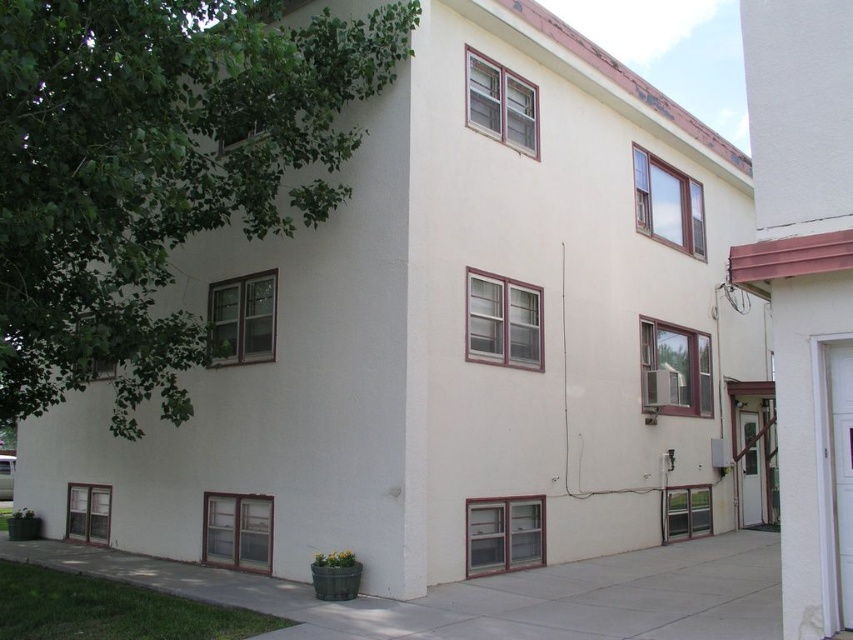
Question: Does green leafy tree at upper left have a larger size compared to white glossy door at right?

Choices:
 (A) no
 (B) yes

Answer: (A)

Question: Which is farther from the white glossy door at right?

Choices:
 (A) white glossy door at lower right
 (B) green leafy tree at upper left

Answer: (A)

Question: Which point appears farthest from the camera in this image?

Choices:
 (A) (836, 582)
 (B) (141, 330)

Answer: (B)

Question: Which of the following is the closest to the observer?

Choices:
 (A) (851, 540)
 (B) (738, 420)

Answer: (A)

Question: Where is green leafy tree at upper left located in relation to white glossy door at lower right in the image?

Choices:
 (A) below
 (B) above

Answer: (B)

Question: Does green leafy tree at upper left have a larger size compared to white glossy door at lower right?

Choices:
 (A) no
 (B) yes

Answer: (A)